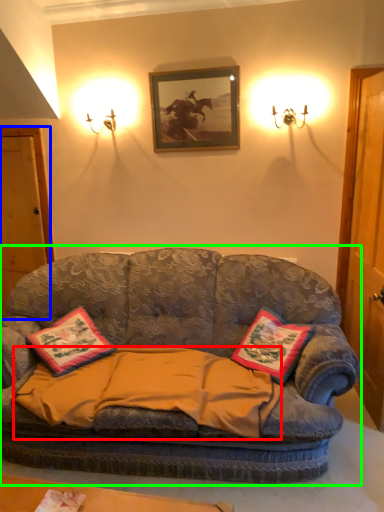
Question: Which is farther away from blanket (highlighted by a red box)? door (highlighted by a blue box) or studio couch (highlighted by a green box)?

Choices:
 (A) door
 (B) studio couch

Answer: (A)